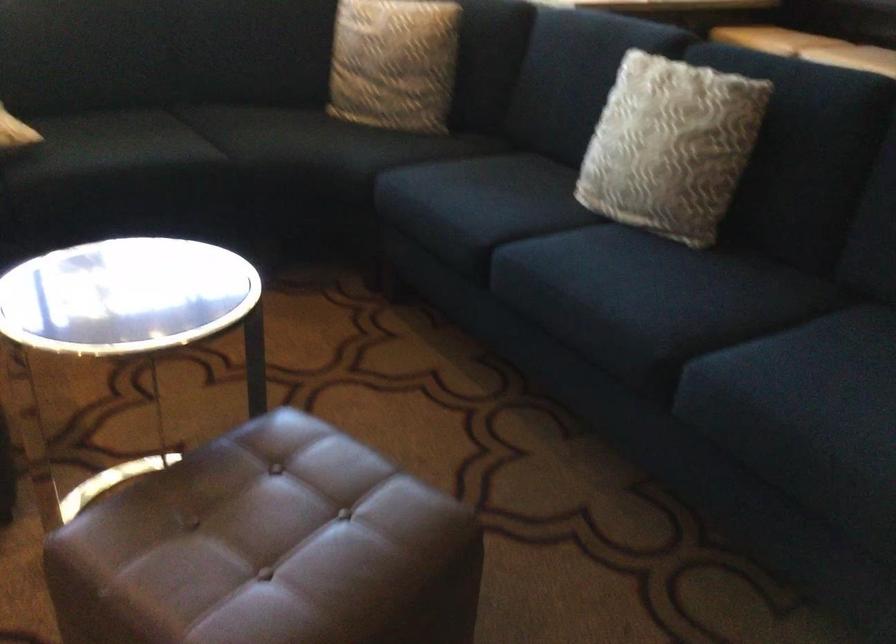
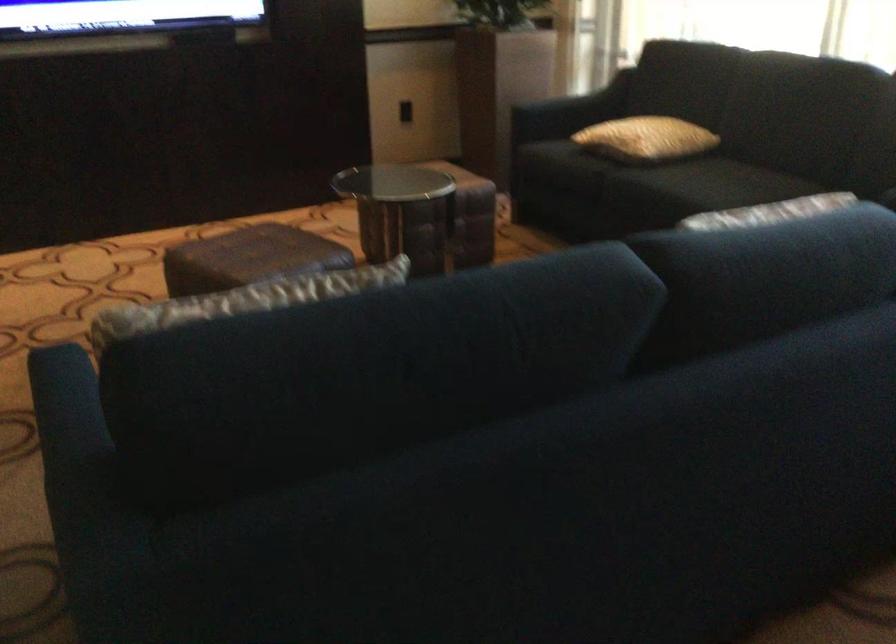
Where in the second image is the point corresponding to point 346,514 from the first image?

(248, 258)